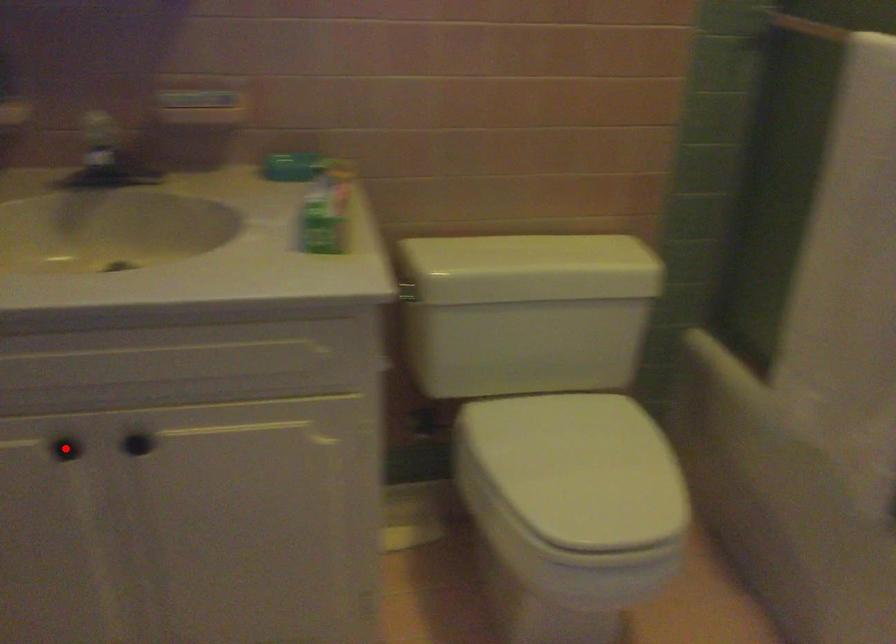
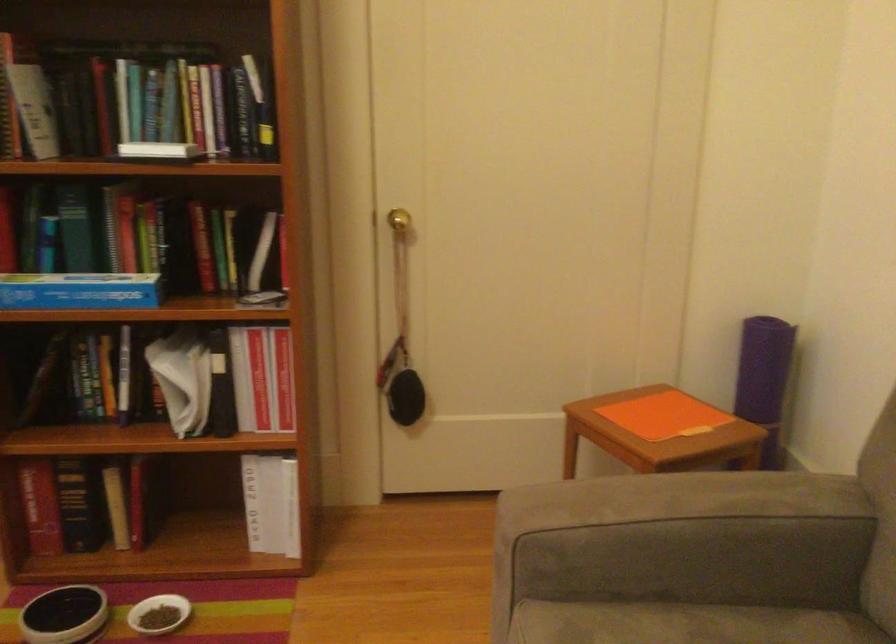
Question: I am providing you with two images of the same scene from different viewpoints. A red point is marked on the first image. At the location where the point appears in image 1, is it still visible in image 2?

Choices:
 (A) Yes
 (B) No

Answer: (B)